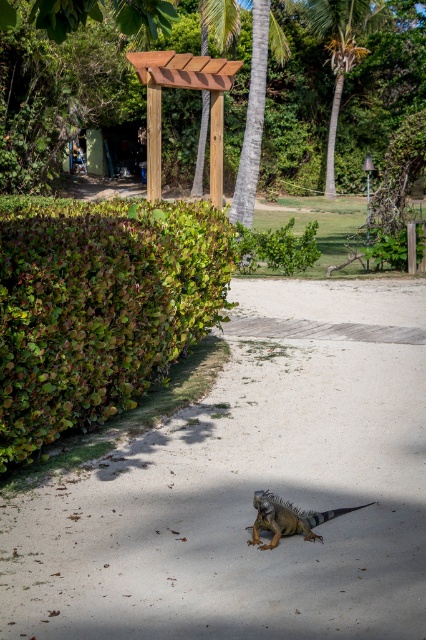
Can you confirm if sandy beige path at center is positioned to the right of green leafy palm tree at upper center?

No, sandy beige path at center is not to the right of green leafy palm tree at upper center.

Does point (253, 426) come closer to viewer compared to point (316, 29)?

Yes, it is.

Who is more forward, (270, 316) or (319, 1)?

Point (270, 316) is in front.

The height and width of the screenshot is (640, 426). In order to click on sandy beige path at center in this screenshot , I will do pyautogui.click(x=250, y=488).

Between wooden pergola at upper center and green scaly iguana at lower center, which one is positioned higher?

wooden pergola at upper center is higher up.

Is point (209, 72) more distant than point (290, 529)?

Yes.

Which is behind, point (221, 128) or point (296, 515)?

Positioned behind is point (221, 128).

Where is `wooden pergola at upper center`? Image resolution: width=426 pixels, height=640 pixels. wooden pergola at upper center is located at coordinates (184, 88).

Is sandy beige path at center smaller than green leafy hedge at left?

Yes.

Who is more distant from viewer, (175, 586) or (29, 296)?

Point (29, 296)

You are a GUI agent. You are given a task and a screenshot of the screen. Output one action in this format:
    pyautogui.click(x=<x>, y=<y>)
    Task: Click on the sandy beige path at center
    This screenshot has width=426, height=640.
    Given the screenshot: What is the action you would take?
    pyautogui.click(x=250, y=488)